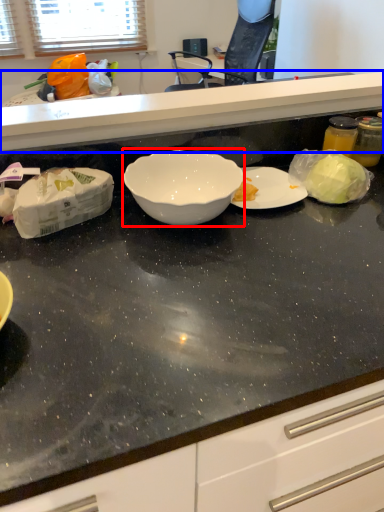
Question: Which object is further to the camera taking this photo, bowl (highlighted by a red box) or countertop (highlighted by a blue box)?

Choices:
 (A) bowl
 (B) countertop

Answer: (B)